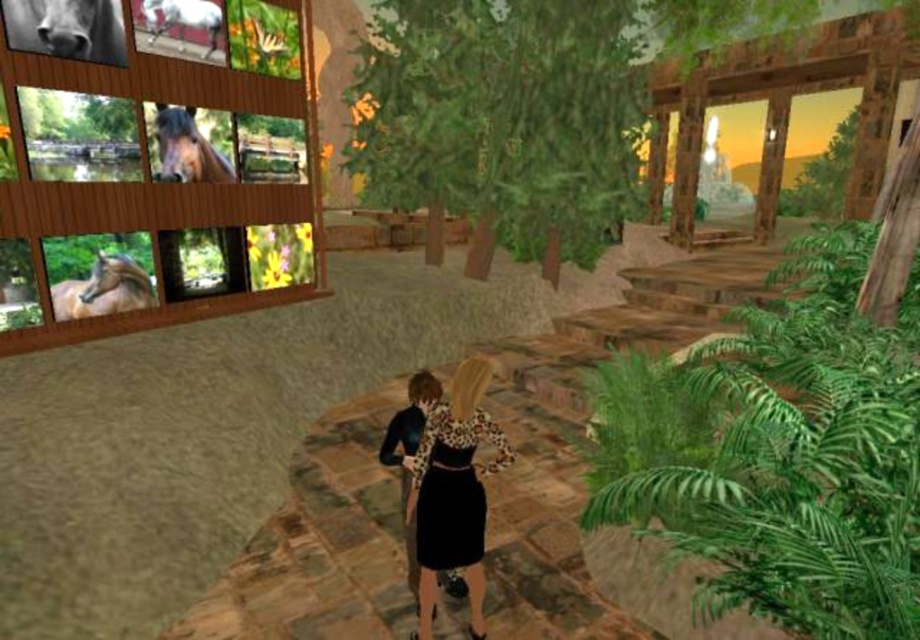
Can you confirm if black velvet dress at center is smaller than black glossy horse at upper left?

Yes, black velvet dress at center is smaller than black glossy horse at upper left.

Who is lower down, black velvet dress at center or black glossy horse at upper left?

black velvet dress at center

Who is more forward, (469,564) or (52,29)?

Point (469,564)

Image resolution: width=920 pixels, height=640 pixels. I want to click on black velvet dress at center, so click(453, 490).

Does brown glossy horse at left appear on the left side of brown glossy horse at upper left?

Yes, brown glossy horse at left is to the left of brown glossy horse at upper left.

Between brown glossy horse at left and brown glossy horse at upper left, which one appears on the right side from the viewer's perspective?

brown glossy horse at upper left is more to the right.

Where is `brown glossy horse at left`? The height and width of the screenshot is (640, 920). brown glossy horse at left is located at coordinates (104, 289).

Does green leafy plant at right appear over green leafy trees at center?

Actually, green leafy plant at right is below green leafy trees at center.

Who is positioned more to the left, green leafy plant at right or green leafy trees at center?

green leafy plant at right

You are a GUI agent. You are given a task and a screenshot of the screen. Output one action in this format:
    pyautogui.click(x=<x>, y=<y>)
    Task: Click on the green leafy plant at right
    The image size is (920, 640).
    Given the screenshot: What is the action you would take?
    pyautogui.click(x=782, y=451)